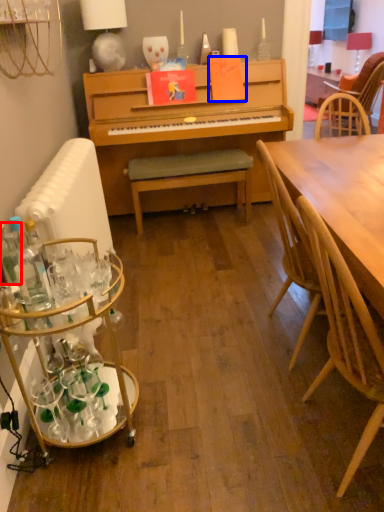
Question: Among these objects, which one is farthest to the camera, bottle (highlighted by a red box) or book (highlighted by a blue box)?

Choices:
 (A) bottle
 (B) book

Answer: (B)